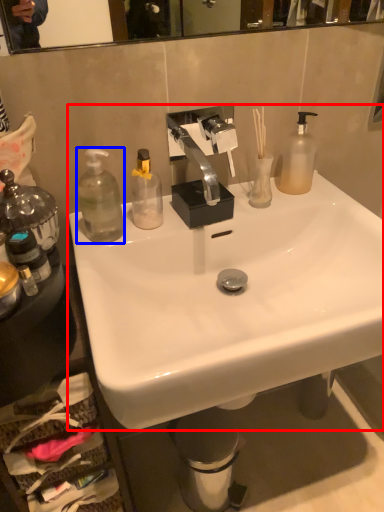
Question: Which object appears closest to the camera in this image, sink (highlighted by a red box) or bottle (highlighted by a blue box)?

Choices:
 (A) sink
 (B) bottle

Answer: (A)